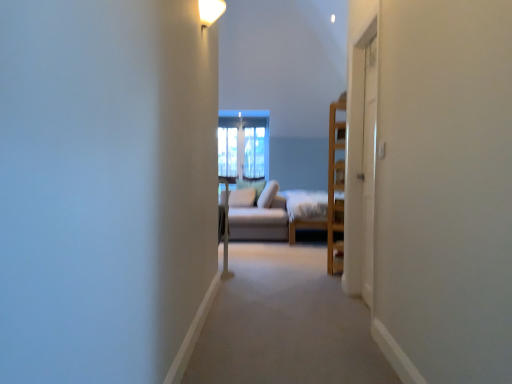
Question: Is beige fabric couch at center to the right of light brown wooden bed frame at center from the viewer's perspective?

Choices:
 (A) no
 (B) yes

Answer: (A)

Question: Considering the relative sizes of beige fabric couch at center and light brown wooden bed frame at center in the image provided, is beige fabric couch at center taller than light brown wooden bed frame at center?

Choices:
 (A) yes
 (B) no

Answer: (B)

Question: Is beige fabric couch at center bigger than light brown wooden bed frame at center?

Choices:
 (A) yes
 (B) no

Answer: (B)

Question: From the image's perspective, is beige fabric couch at center over light brown wooden bed frame at center?

Choices:
 (A) yes
 (B) no

Answer: (B)

Question: Is beige fabric couch at center aimed at light brown wooden bed frame at center?

Choices:
 (A) yes
 (B) no

Answer: (B)

Question: From the image's perspective, is beige fabric couch at center beneath light brown wooden bed frame at center?

Choices:
 (A) yes
 (B) no

Answer: (A)

Question: Considering the relative positions of white glossy light fixture at upper center and light brown wooden bed frame at center in the image provided, is white glossy light fixture at upper center to the left of light brown wooden bed frame at center from the viewer's perspective?

Choices:
 (A) yes
 (B) no

Answer: (A)

Question: Can you confirm if white glossy light fixture at upper center is shorter than light brown wooden bed frame at center?

Choices:
 (A) no
 (B) yes

Answer: (B)

Question: Are white glossy light fixture at upper center and light brown wooden bed frame at center far apart?

Choices:
 (A) yes
 (B) no

Answer: (A)

Question: Can you confirm if white glossy light fixture at upper center is wider than light brown wooden bed frame at center?

Choices:
 (A) yes
 (B) no

Answer: (B)

Question: Does white glossy light fixture at upper center appear on the right side of light brown wooden bed frame at center?

Choices:
 (A) yes
 (B) no

Answer: (B)

Question: Is white glossy light fixture at upper center taller than light brown wooden bed frame at center?

Choices:
 (A) yes
 (B) no

Answer: (B)

Question: Is light brown wooden bed frame at center in front of white glossy light fixture at upper center?

Choices:
 (A) yes
 (B) no

Answer: (B)